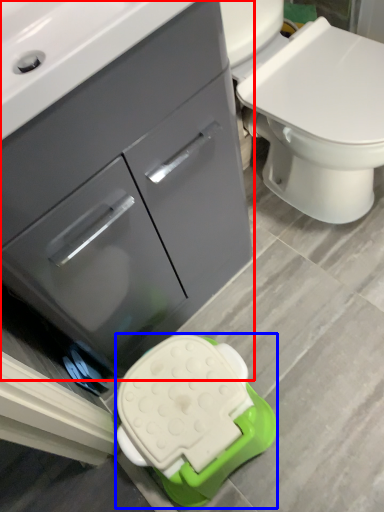
Question: Which of the following is the farthest to the observer, bathroom cabinet (highlighted by a red box) or porcelain (highlighted by a blue box)?

Choices:
 (A) bathroom cabinet
 (B) porcelain

Answer: (B)